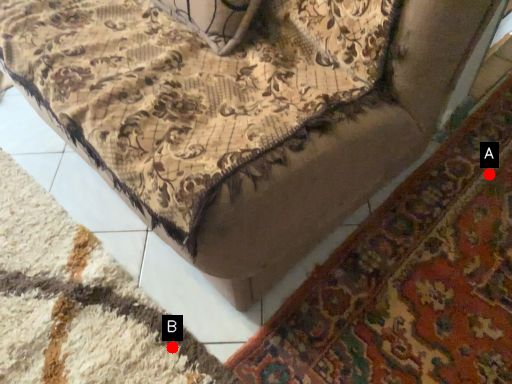
Question: Two points are circled on the image, labeled by A and B beside each circle. Which point is farther from the camera taking this photo?

Choices:
 (A) A is further
 (B) B is further

Answer: (A)